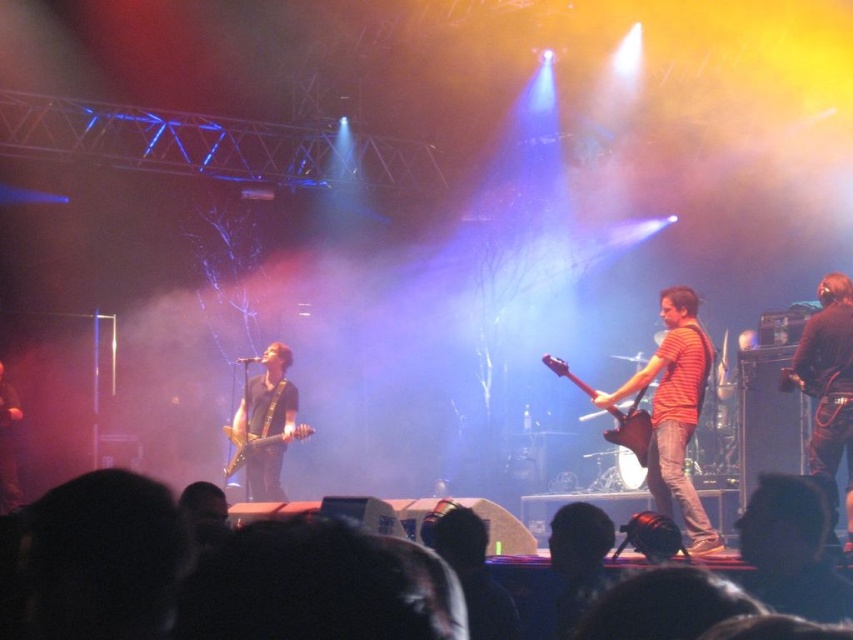
Question: Is the position of glossy electric guitar at center more distant than that of dark brown leather jacket at left?

Choices:
 (A) no
 (B) yes

Answer: (A)

Question: Among these objects, which one is nearest to the camera?

Choices:
 (A) dark brown leather jacket at left
 (B) orange striped shirt at center

Answer: (B)

Question: Which point is closer to the camera taking this photo?

Choices:
 (A) (677, 436)
 (B) (308, 426)
 (C) (631, 433)

Answer: (A)

Question: Which point is closer to the camera?

Choices:
 (A) glossy electric guitar at center
 (B) orange striped shirt at center
 (C) matte black guitar at center
 (D) black leather jacket at right

Answer: (D)

Question: Observing the image, what is the correct spatial positioning of matte black guitar at center in reference to glossy electric guitar at center?

Choices:
 (A) left
 (B) right

Answer: (A)

Question: In this image, where is black leather jacket at right located relative to matte black guitar at center?

Choices:
 (A) below
 (B) above

Answer: (B)